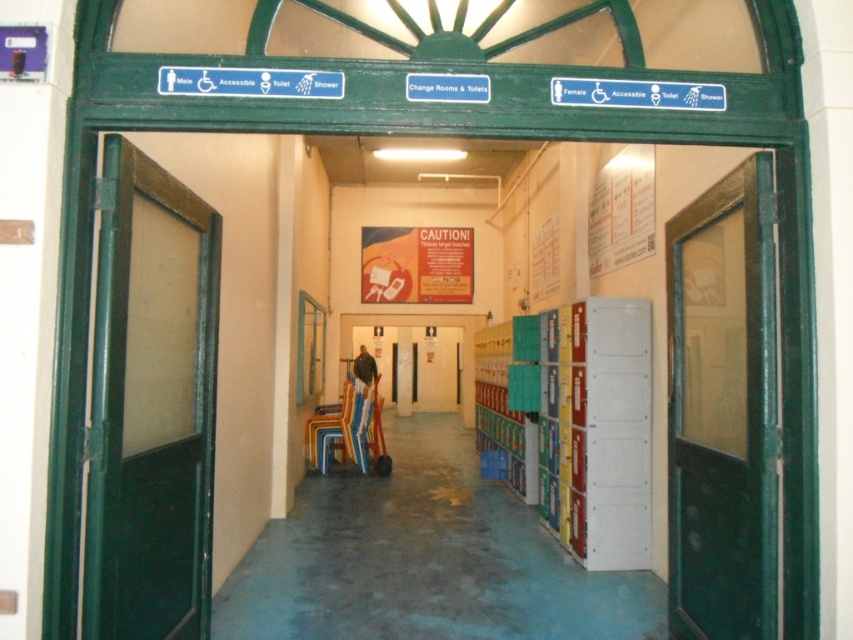
You are a maintenance worker needing to access the electrical panel located behind the green matte door at left and the green glass door at center. Which door should you open first if you want to reach the electrical panel without passing through both?

The green matte door at left should be opened first because it occupies less space than the green glass door at center, allowing easier access to the electrical panel without needing to go through both doors.

You are a maintenance worker needing to access the electrical panel located between the green matte door at left and the green glass door at center. Can you fit a 6.5 feet long ladder between them?

The distance between the green matte door at left and the green glass door at center is 7.17 feet. Since the ladder is 6.5 feet long, it will fit with some space to spare.